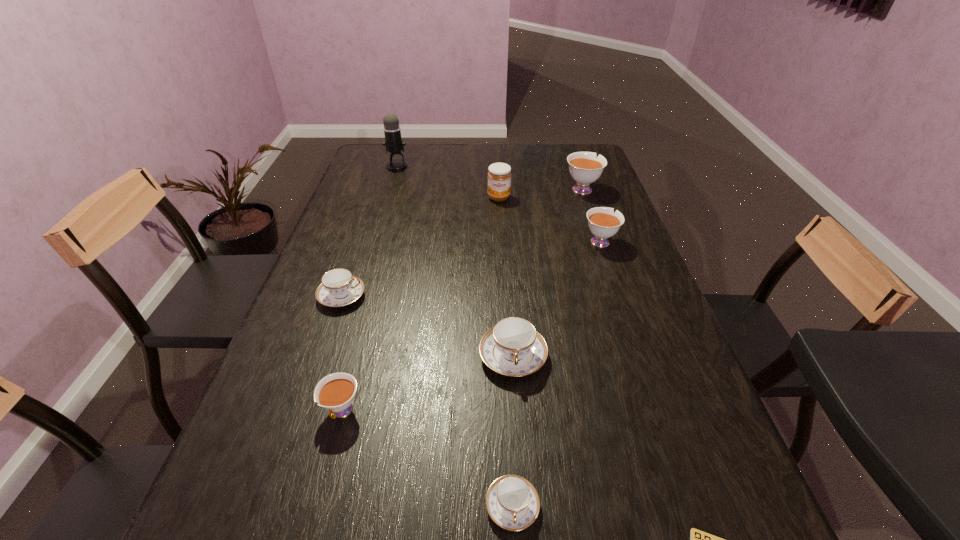
This screenshot has height=540, width=960. I want to click on vacant space located 0.150m on the side of the second smallest white teacup with the handle, so click(x=587, y=203).

You are a GUI agent. You are given a task and a screenshot of the screen. Output one action in this format:
    pyautogui.click(x=<x>, y=<y>)
    Task: Click on the free space located 0.200m on the side of the second smallest white teacup with the handle
    The image size is (960, 540).
    Given the screenshot: What is the action you would take?
    pyautogui.click(x=584, y=195)

Where is `blank area located 0.050m on the side of the second smallest white teacup with the handle`? This screenshot has width=960, height=540. blank area located 0.050m on the side of the second smallest white teacup with the handle is located at coordinates (592, 220).

Find the location of a particular element. free region located 0.150m on the side with the handle of the second nearest blue teacup is located at coordinates (520, 453).

Image resolution: width=960 pixels, height=540 pixels. I want to click on free space located on the side of the nearest white teacup with the handle, so click(326, 469).

This screenshot has width=960, height=540. Identify the location of vacant space located on the side with the handle of the second biggest blue teacup. (507, 296).

This screenshot has height=540, width=960. Find the location of `object that is at the far edge`. object that is at the far edge is located at coordinates (393, 142).

At what (x,y) coordinates should I click in order to perform the action: click on microphone that is at the left edge. Please return your answer as a coordinate pair (x, y). The width and height of the screenshot is (960, 540). Looking at the image, I should click on (393, 142).

The width and height of the screenshot is (960, 540). What are the coordinates of `object at the far left corner` in the screenshot? It's located at (393, 142).

Image resolution: width=960 pixels, height=540 pixels. Identify the location of free space at the far edge of the desktop. (536, 153).